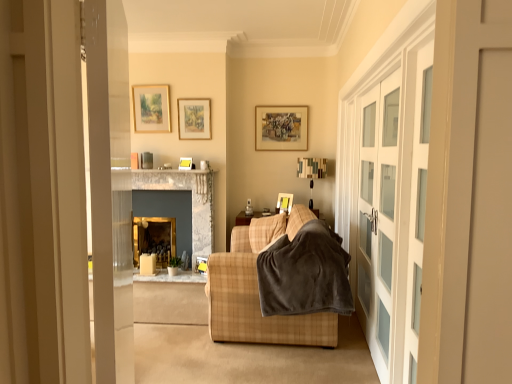
Question: Is plaid fabric couch at center completely or partially outside of matte yellow picture frame at center, which ranks as the second picture frame in bottom-to-top order?

Choices:
 (A) yes
 (B) no

Answer: (A)

Question: Could matte yellow picture frame at center, which ranks as the second picture frame in bottom-to-top order, be considered to be inside plaid fabric couch at center?

Choices:
 (A) no
 (B) yes

Answer: (A)

Question: Considering the relative sizes of plaid fabric couch at center and matte yellow picture frame at center, positioned as the 1th picture frame in right-to-left order, in the image provided, is plaid fabric couch at center taller than matte yellow picture frame at center, positioned as the 1th picture frame in right-to-left order,?

Choices:
 (A) yes
 (B) no

Answer: (A)

Question: Is plaid fabric couch at center not near matte yellow picture frame at center, marked as the 6th picture frame in a left-to-right arrangement?

Choices:
 (A) yes
 (B) no

Answer: (B)

Question: From a real-world perspective, is plaid fabric couch at center positioned over matte yellow picture frame at center, which is counted as the fifth picture frame, starting from the top, based on gravity?

Choices:
 (A) yes
 (B) no

Answer: (B)

Question: From a real-world perspective, is gold metallic fireplace at center, the 1th fireplace when ordered from right to left, positioned above or below wooden picture frame at center, the 6th picture frame when ordered from top to bottom?

Choices:
 (A) above
 (B) below

Answer: (A)

Question: From the image's perspective, is gold metallic fireplace at center, acting as the 2th fireplace starting from the left, above or below wooden picture frame at center, placed as the 3th picture frame when sorted from right to left?

Choices:
 (A) above
 (B) below

Answer: (A)

Question: Considering the relative positions of gold metallic fireplace at center, acting as the 2th fireplace starting from the left, and wooden picture frame at center, which is the fourth picture frame from left to right, in the image provided, is gold metallic fireplace at center, acting as the 2th fireplace starting from the left, to the left or to the right of wooden picture frame at center, which is the fourth picture frame from left to right,?

Choices:
 (A) left
 (B) right

Answer: (A)

Question: Which is correct: gold metallic fireplace at center, the 1th fireplace when ordered from right to left, is inside wooden picture frame at center, placed as the first picture frame when sorted from bottom to top, or outside of it?

Choices:
 (A) inside
 (B) outside

Answer: (B)

Question: Based on their sizes in the image, would you say plaid fabric couch at center is bigger or smaller than white glass cabinet doors at right, the second screen door from the back?

Choices:
 (A) big
 (B) small

Answer: (A)

Question: Considering their positions, is plaid fabric couch at center located in front of or behind white glass cabinet doors at right, the second screen door from the back?

Choices:
 (A) front
 (B) behind

Answer: (B)

Question: From a real-world perspective, is plaid fabric couch at center above or below white glass cabinet doors at right, the second screen door from the back?

Choices:
 (A) above
 (B) below

Answer: (B)

Question: Is plaid fabric couch at center situated inside white glass cabinet doors at right, the second screen door from the back, or outside?

Choices:
 (A) outside
 (B) inside

Answer: (A)

Question: In terms of height, does gold metallic fireplace at center, acting as the 2th fireplace starting from the left, look taller or shorter compared to matte wooden picture frame at upper center, which is the 1th picture frame from top to bottom?

Choices:
 (A) short
 (B) tall

Answer: (B)

Question: Choose the correct answer: Is gold metallic fireplace at center, the 1th fireplace when ordered from right to left, inside matte wooden picture frame at upper center, placed as the 6th picture frame when sorted from bottom to top, or outside it?

Choices:
 (A) outside
 (B) inside

Answer: (A)